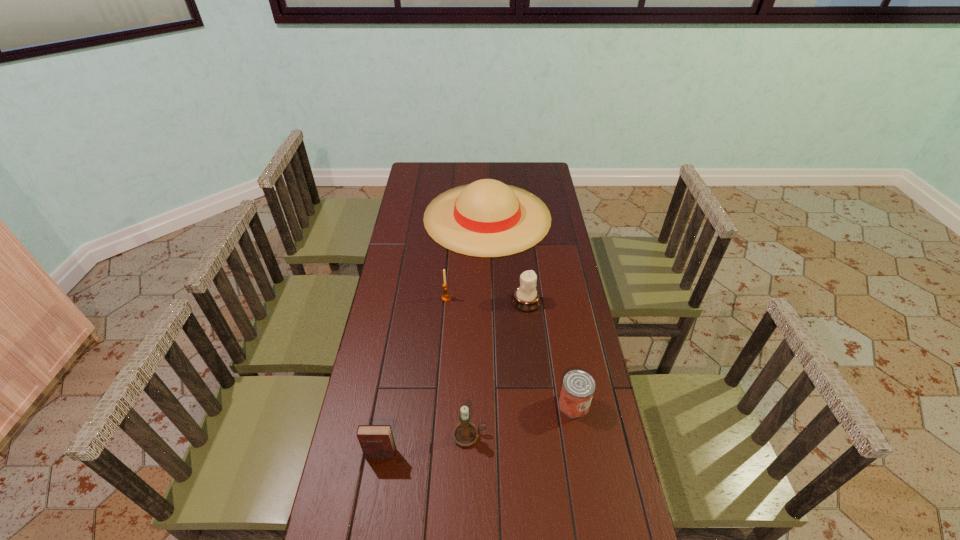
At what (x,y) coordinates should I click in order to perform the action: click on can that is at the right edge. Please return your answer as a coordinate pair (x, y). Looking at the image, I should click on (578, 387).

I want to click on object at the far left corner, so click(x=487, y=218).

Locate an element on the screen. object positioned at the far right corner is located at coordinates (487, 218).

In the image, there is a desktop. At what (x,y) coordinates should I click in order to perform the action: click on vacant space at the far edge. Please return your answer as a coordinate pair (x, y). Looking at the image, I should click on (444, 180).

The image size is (960, 540). Find the location of `vacant point at the left edge`. vacant point at the left edge is located at coordinates (416, 267).

This screenshot has height=540, width=960. Find the location of `vacant space at the right edge of the desktop`. vacant space at the right edge of the desktop is located at coordinates (565, 238).

Identify the location of vacant space at the far right corner of the desktop. (548, 171).

At what (x,y) coordinates should I click in order to perform the action: click on blank region between the nearest object and the tallest object. Please return your answer as a coordinate pair (x, y). This screenshot has width=960, height=540. Looking at the image, I should click on (434, 335).

Locate an element on the screen. The width and height of the screenshot is (960, 540). empty space that is in between the nearest object and the fifth farthest object is located at coordinates (425, 444).

This screenshot has height=540, width=960. I want to click on free area in between the nearest candle holder and the nearest object, so click(425, 444).